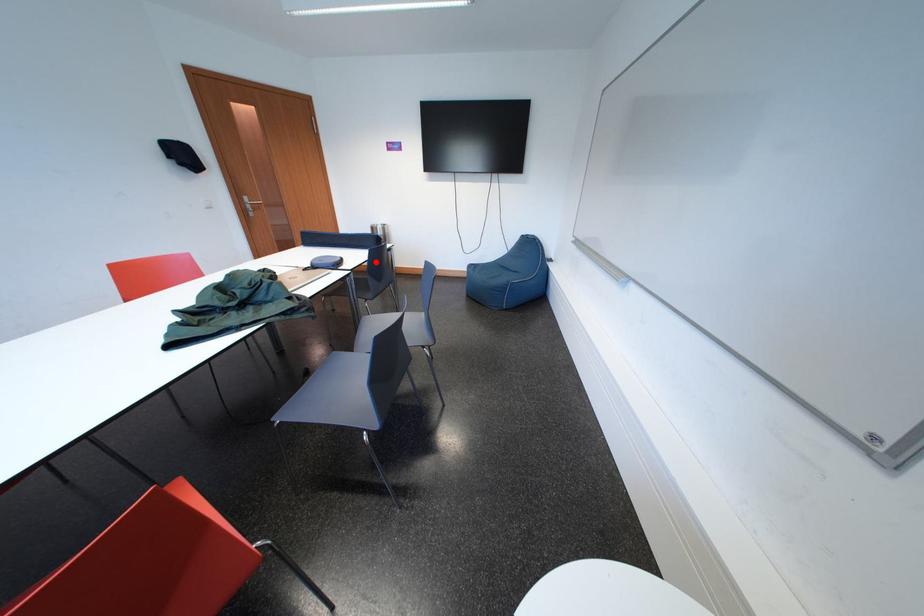
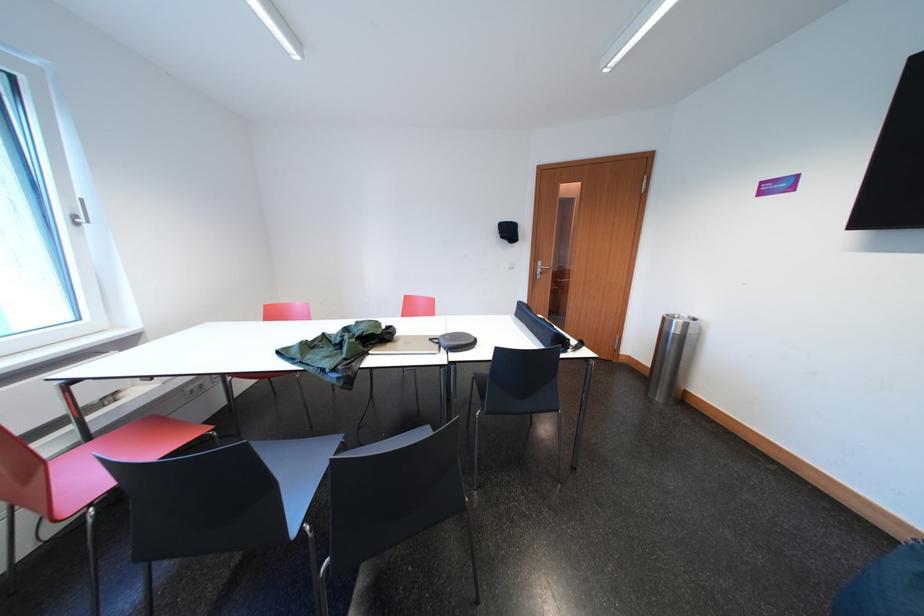
Locate, in the second image, the point that corresponds to the highlighted location in the first image.

(499, 361)